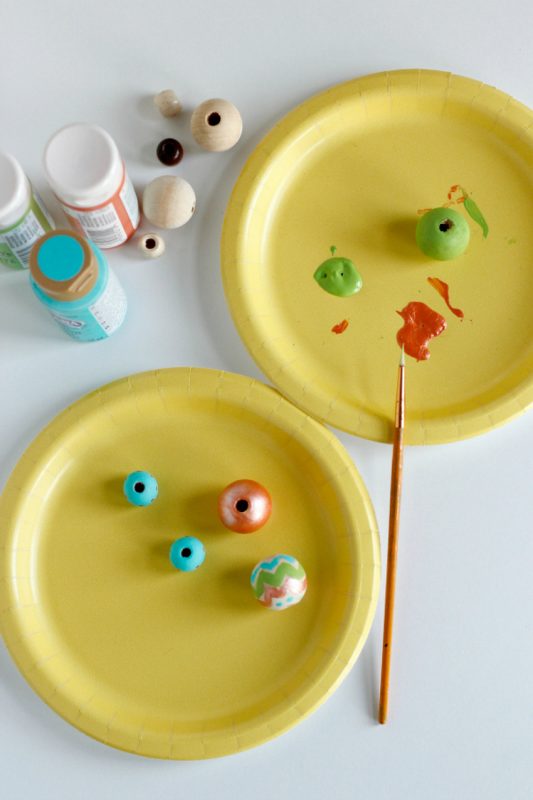
Locate an element on the screen. green paint is located at coordinates (7, 258).